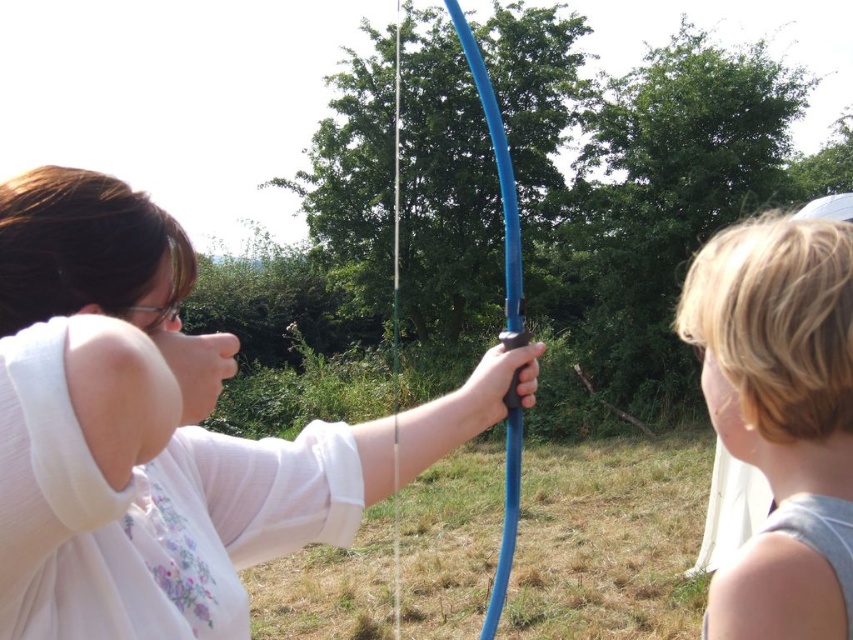
Question: Which point is farther to the camera?

Choices:
 (A) blue rubber hose at center
 (B) matte white shirt at center
 (C) blonde hair at right

Answer: (A)

Question: Is matte white shirt at center in front of blonde hair at right?

Choices:
 (A) yes
 (B) no

Answer: (A)

Question: Can you confirm if matte white shirt at center is smaller than blue rubber hose at center?

Choices:
 (A) yes
 (B) no

Answer: (A)

Question: Which of the following is the closest to the observer?

Choices:
 (A) (225, 536)
 (B) (492, 608)
 (C) (721, 596)

Answer: (C)

Question: Which object appears closest to the camera in this image?

Choices:
 (A) blonde hair at right
 (B) blue rubber hose at center
 (C) matte white shirt at center

Answer: (C)

Question: Is matte white shirt at center further to camera compared to blonde hair at right?

Choices:
 (A) no
 (B) yes

Answer: (A)